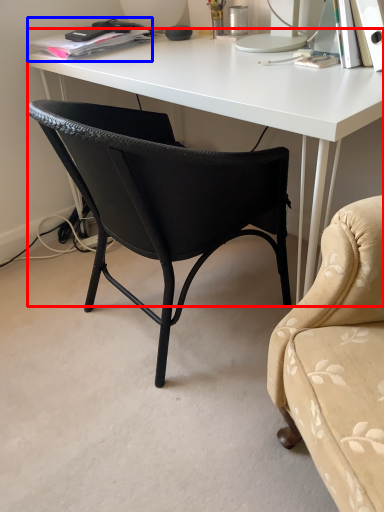
Question: Which point is further to the camera, desk (highlighted by a red box) or book (highlighted by a blue box)?

Choices:
 (A) desk
 (B) book

Answer: (B)